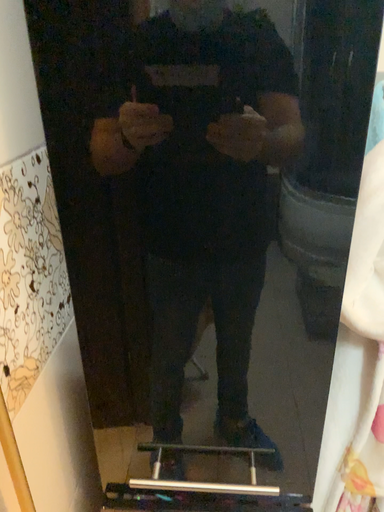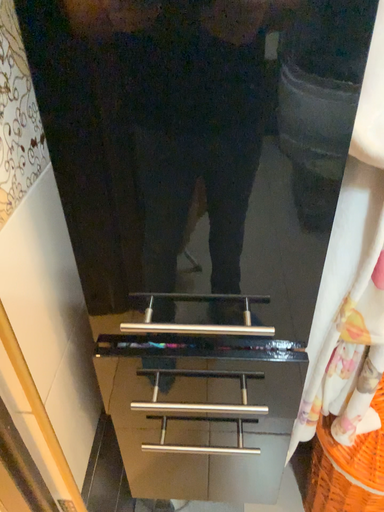
Question: How did the camera likely rotate when shooting the video?

Choices:
 (A) rotated downward
 (B) rotated upward

Answer: (A)